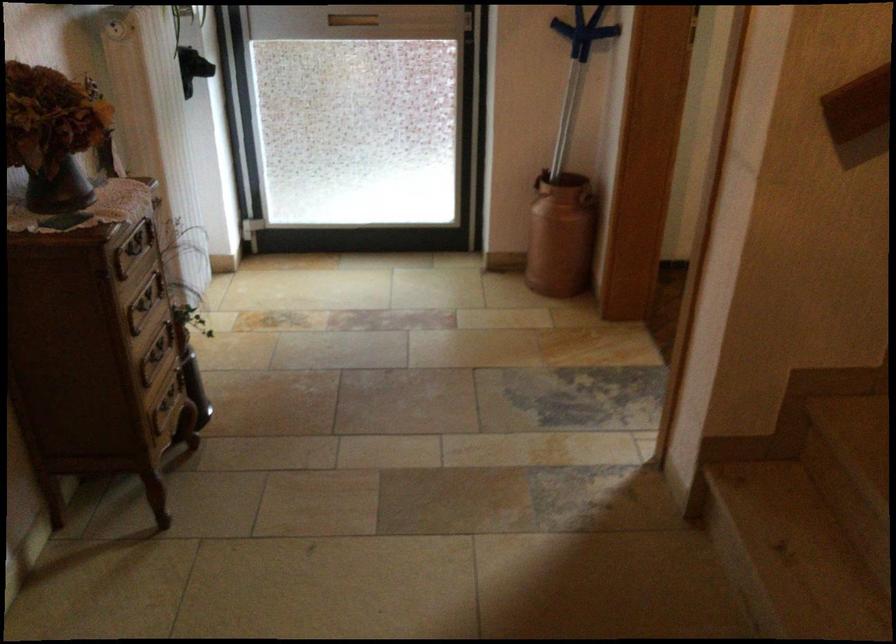
The image size is (896, 644). What do you see at coordinates (583, 31) in the screenshot?
I see `a blue mop handle` at bounding box center [583, 31].